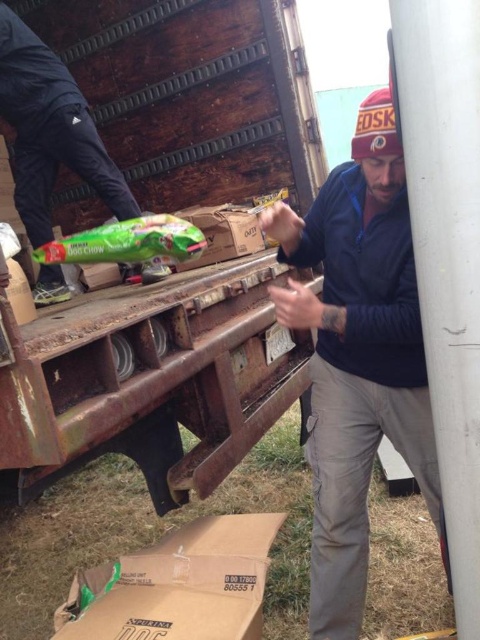
Question: Can you confirm if brown cardboard box at lower center is positioned to the right of green matte dog chow bag at left?

Choices:
 (A) no
 (B) yes

Answer: (B)

Question: Which object is closer to the camera taking this photo?

Choices:
 (A) blue fleece jacket at center
 (B) brown cardboard box at center

Answer: (A)

Question: Among these points, which one is nearest to the camera?

Choices:
 (A) (49, 72)
 (B) (252, 244)
 (C) (232, 109)

Answer: (A)

Question: Which of the following is the closest to the observer?

Choices:
 (A) metallic gray pole at right
 (B) blue fleece jacket at center
 (C) brown cardboard box at center
 (D) brown cardboard box at lower center

Answer: (A)

Question: Is blue fleece jacket at center to the right of metallic gray pole at right from the viewer's perspective?

Choices:
 (A) no
 (B) yes

Answer: (A)

Question: From the image, what is the correct spatial relationship of rusty metal trailer truck at upper left in relation to blue fleece jacket at center?

Choices:
 (A) above
 (B) below

Answer: (A)